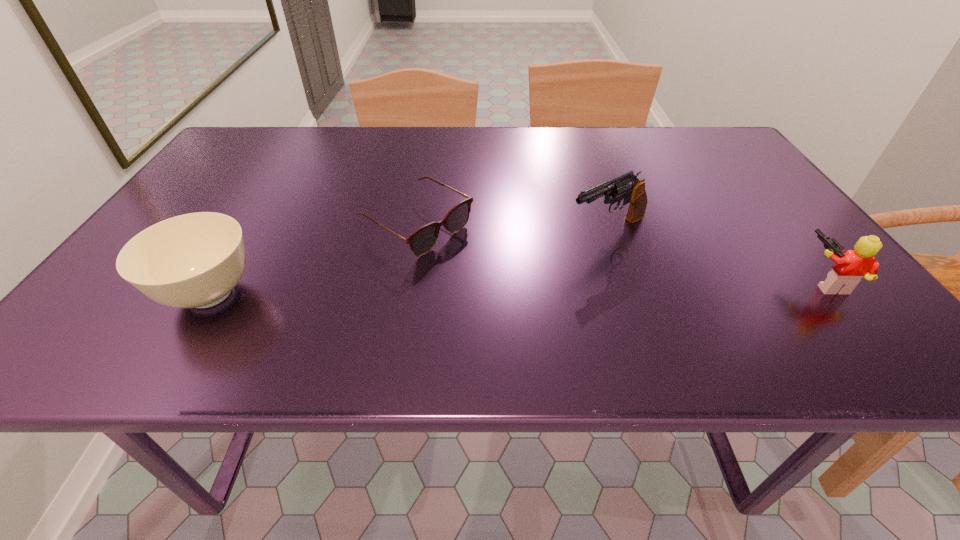
Locate an element on the screen. Image resolution: width=960 pixels, height=540 pixels. vacant area that satisfies the following two spatial constraints: 1. on the back side of the sugar bowl; 2. on the right side of the spectacles is located at coordinates (251, 226).

Find the location of a particular element. This screenshot has height=540, width=960. vacant space that satisfies the following two spatial constraints: 1. on the back side of the sugar bowl; 2. in front of the Lego with the accessory visible is located at coordinates (218, 281).

You are a GUI agent. You are given a task and a screenshot of the screen. Output one action in this format:
    pyautogui.click(x=<x>, y=<y>)
    Task: Click on the free region that satisfies the following two spatial constraints: 1. on the back side of the rightmost object; 2. in front of the sugar bowl with the accessory visible
    
    Given the screenshot: What is the action you would take?
    pyautogui.click(x=218, y=281)

This screenshot has width=960, height=540. I want to click on vacant space that satisfies the following two spatial constraints: 1. on the back side of the rightmost object; 2. in front of the leftmost object with the accessory visible, so click(218, 281).

Locate an element on the screen. The width and height of the screenshot is (960, 540). blank space that satisfies the following two spatial constraints: 1. on the back side of the sugar bowl; 2. in front of the rightmost object with the accessory visible is located at coordinates (218, 281).

What are the coordinates of `free spot that satisfies the following two spatial constraints: 1. on the front side of the Lego; 2. in front of the shortest object with the accessory visible` in the screenshot? It's located at (408, 281).

At what (x,y) coordinates should I click in order to perform the action: click on blank space that satisfies the following two spatial constraints: 1. on the back side of the leftmost object; 2. in front of the rightmost object with the accessory visible. Please return your answer as a coordinate pair (x, y). This screenshot has height=540, width=960. Looking at the image, I should click on tap(218, 281).